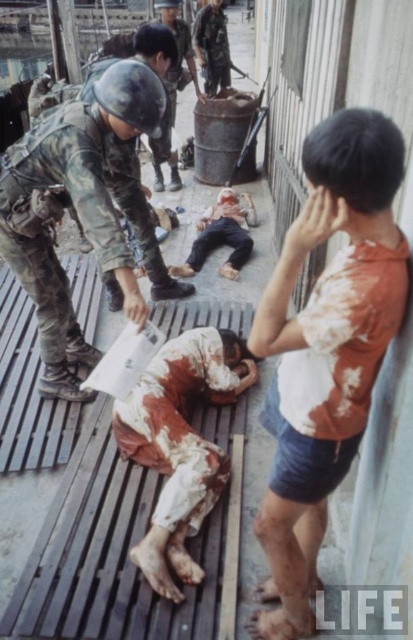
Which is more to the left, dirty orange shirt at right or camouflage fabric uniform at center?

Positioned to the left is camouflage fabric uniform at center.

Does point (360, 275) come behind point (227, 76)?

No, it is not.

Where is `dirty orange shirt at right`? This screenshot has height=640, width=413. dirty orange shirt at right is located at coordinates (327, 346).

Does camouflage fabric soldier at center have a lesser width compared to camouflage uniform at center?

No, camouflage fabric soldier at center is not thinner than camouflage uniform at center.

Can you confirm if camouflage fabric soldier at center is taller than camouflage uniform at center?

No, camouflage fabric soldier at center is not taller than camouflage uniform at center.

Measure the distance between point (106,268) and camera.

2.51 meters

You are a GUI agent. You are given a task and a screenshot of the screen. Output one action in this format:
    pyautogui.click(x=<x>, y=<y>)
    Task: Click on the camouflage fabric soldier at center
    This screenshot has width=413, height=640.
    Given the screenshot: What is the action you would take?
    pyautogui.click(x=75, y=211)

Can you confirm if camouflage fabric soldier at center is wider than camouflage fabric uniform at center?

Yes.

Between point (28, 141) and point (215, 1), which one is positioned in front?

Point (28, 141) is more forward.

Where is `camouflage fabric soldier at center`? This screenshot has width=413, height=640. camouflage fabric soldier at center is located at coordinates (75, 211).